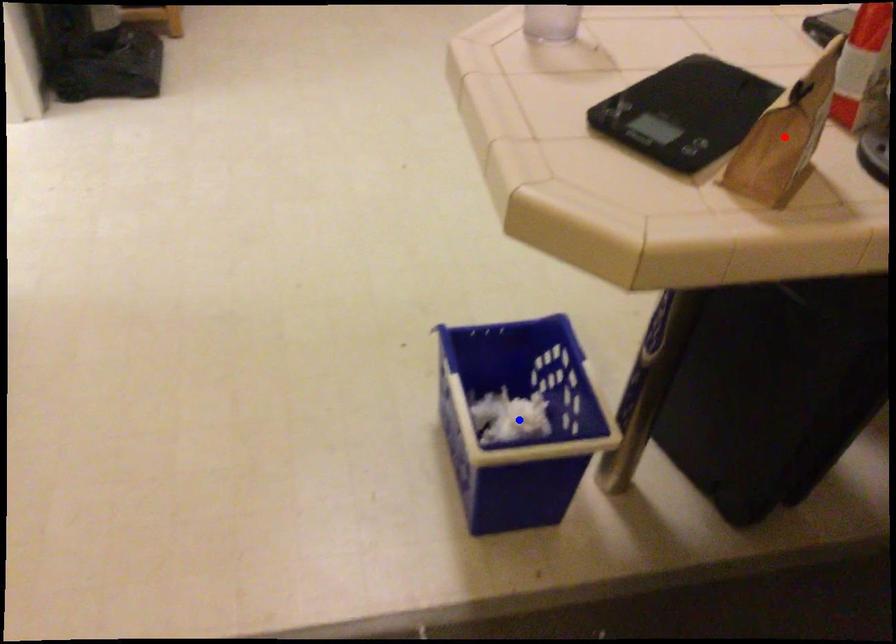
Question: In the image, two points are highlighted. Which point is nearer to the camera? Reply with the corresponding letter.

Choices:
 (A) blue point
 (B) red point

Answer: (B)